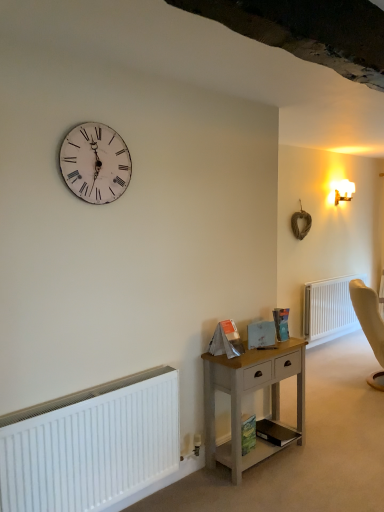
Question: Should I look upward or downward to see white distressed wood clock at upper left?

Choices:
 (A) up
 (B) down

Answer: (A)

Question: Can you confirm if green matte book at lower center, which is the second book from top to bottom, is wider than white matte radiator at lower left, positioned as the second radiator in back-to-front order?

Choices:
 (A) no
 (B) yes

Answer: (A)

Question: Does green matte book at lower center, which is the second book from top to bottom, have a larger size compared to white matte radiator at lower left, arranged as the first radiator when viewed from the front?

Choices:
 (A) yes
 (B) no

Answer: (B)

Question: From the image's perspective, is green matte book at lower center, which is the second book from top to bottom, above white matte radiator at lower left, which ranks as the second radiator in right-to-left order?

Choices:
 (A) no
 (B) yes

Answer: (A)

Question: Is green matte book at lower center, which is the second book from top to bottom, turned away from white matte radiator at lower left, the first radiator from the left?

Choices:
 (A) no
 (B) yes

Answer: (A)

Question: From a real-world perspective, is green matte book at lower center, marked as the second book in a bottom-to-top arrangement, located beneath white matte radiator at lower left, arranged as the first radiator when viewed from the front?

Choices:
 (A) yes
 (B) no

Answer: (A)

Question: From a real-world perspective, is green matte book at lower center, marked as the second book in a bottom-to-top arrangement, on top of white matte radiator at lower left, positioned as the second radiator in back-to-front order?

Choices:
 (A) no
 (B) yes

Answer: (A)

Question: Considering the relative sizes of light wood nightstand at lower center and white plastic radiator at lower right, which appears as the first radiator when viewed from the back, in the image provided, is light wood nightstand at lower center bigger than white plastic radiator at lower right, which appears as the first radiator when viewed from the back,?

Choices:
 (A) no
 (B) yes

Answer: (A)

Question: From a real-world perspective, is light wood nightstand at lower center below white plastic radiator at lower right, arranged as the first radiator when viewed from the right?

Choices:
 (A) no
 (B) yes

Answer: (B)

Question: Is light wood nightstand at lower center thinner than white plastic radiator at lower right, which appears as the first radiator when viewed from the back?

Choices:
 (A) yes
 (B) no

Answer: (B)

Question: Is light wood nightstand at lower center oriented away from white plastic radiator at lower right, arranged as the first radiator when viewed from the right?

Choices:
 (A) yes
 (B) no

Answer: (B)

Question: Are light wood nightstand at lower center and white plastic radiator at lower right, placed as the second radiator when sorted from front to back, far apart?

Choices:
 (A) no
 (B) yes

Answer: (B)

Question: Does light wood nightstand at lower center have a smaller size compared to white plastic radiator at lower right, arranged as the first radiator when viewed from the right?

Choices:
 (A) no
 (B) yes

Answer: (B)

Question: Can you see white matte radiator at lower left, arranged as the first radiator when viewed from the front, touching light wood nightstand at lower center?

Choices:
 (A) yes
 (B) no

Answer: (B)